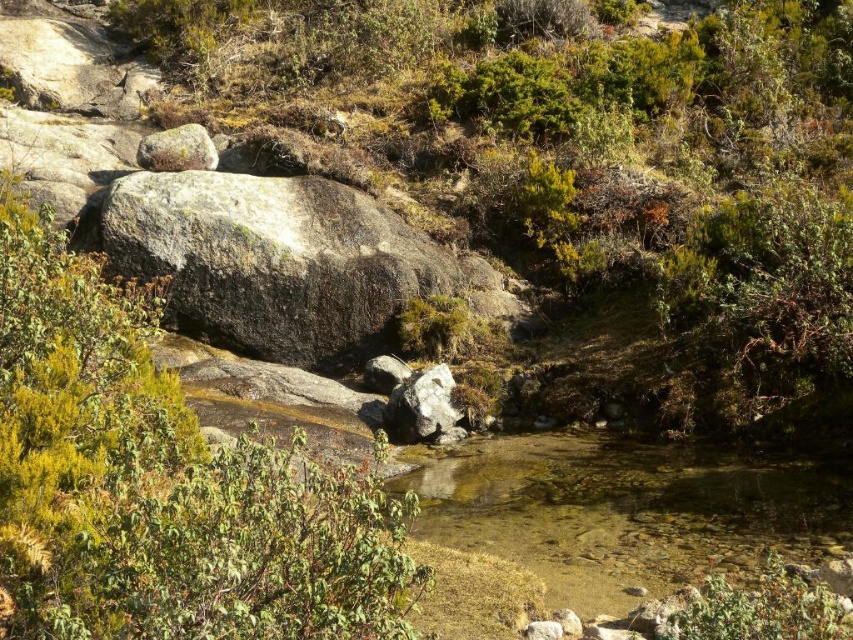
Question: Which of the following is the closest to the observer?

Choices:
 (A) [x=146, y=138]
 (B) [x=416, y=385]

Answer: (B)

Question: Which object is closer to the camera taking this photo?

Choices:
 (A) clear water at center
 (B) sandy brown rock at upper left

Answer: (A)

Question: Considering the real-world distances, which object is farthest from the green leafy shrub at left?

Choices:
 (A) green shrubbery at center
 (B) sandy brown rock at upper left
 (C) clear water at center
 (D) gray rough rock at center

Answer: (B)

Question: Is the position of clear water at center more distant than that of gray rough rock at center?

Choices:
 (A) no
 (B) yes

Answer: (A)

Question: Does green shrubbery at center appear over gray rough rock at center?

Choices:
 (A) no
 (B) yes

Answer: (B)

Question: Where is green shrubbery at center located in relation to green leafy shrub at left in the image?

Choices:
 (A) right
 (B) left

Answer: (A)